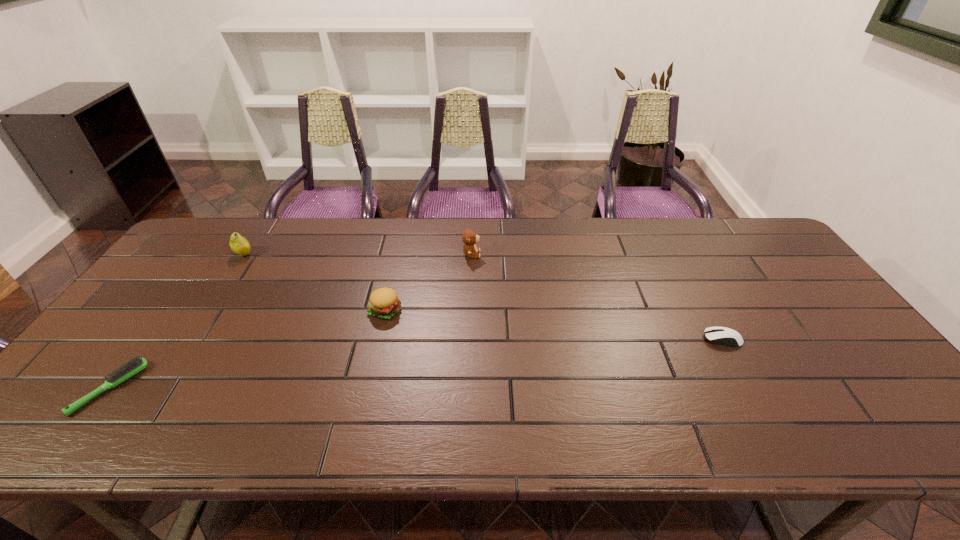
What are the coordinates of `vacant space that satisfies the following two spatial constraints: 1. on the face of the teddy bear; 2. on the left side of the mouse` in the screenshot? It's located at click(469, 339).

You are a GUI agent. You are given a task and a screenshot of the screen. Output one action in this format:
    pyautogui.click(x=<x>, y=<y>)
    Task: Click on the free space that satisfies the following two spatial constraints: 1. on the face of the second object from right to left; 2. on the left side of the rightmost object
    The width and height of the screenshot is (960, 540).
    Given the screenshot: What is the action you would take?
    pyautogui.click(x=469, y=339)

Where is `vacant space that satisfies the following two spatial constraints: 1. on the face of the rightmost object; 2. on the left side of the fourth object from left to right`? The image size is (960, 540). vacant space that satisfies the following two spatial constraints: 1. on the face of the rightmost object; 2. on the left side of the fourth object from left to right is located at coordinates (469, 339).

Identify the location of free space that satisfies the following two spatial constraints: 1. on the front side of the pear; 2. on the right side of the third object from right to left. (207, 310).